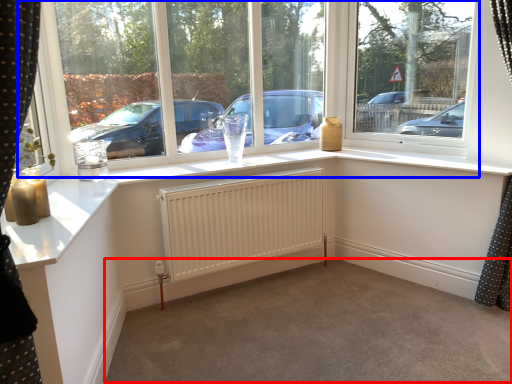
Question: Which point is further to the camera, plain (highlighted by a red box) or window (highlighted by a blue box)?

Choices:
 (A) plain
 (B) window

Answer: (B)